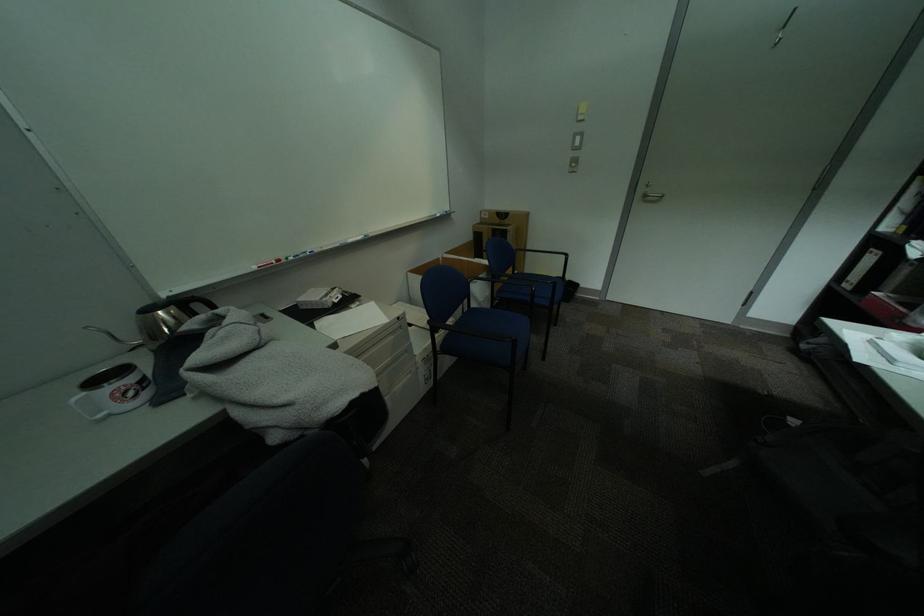
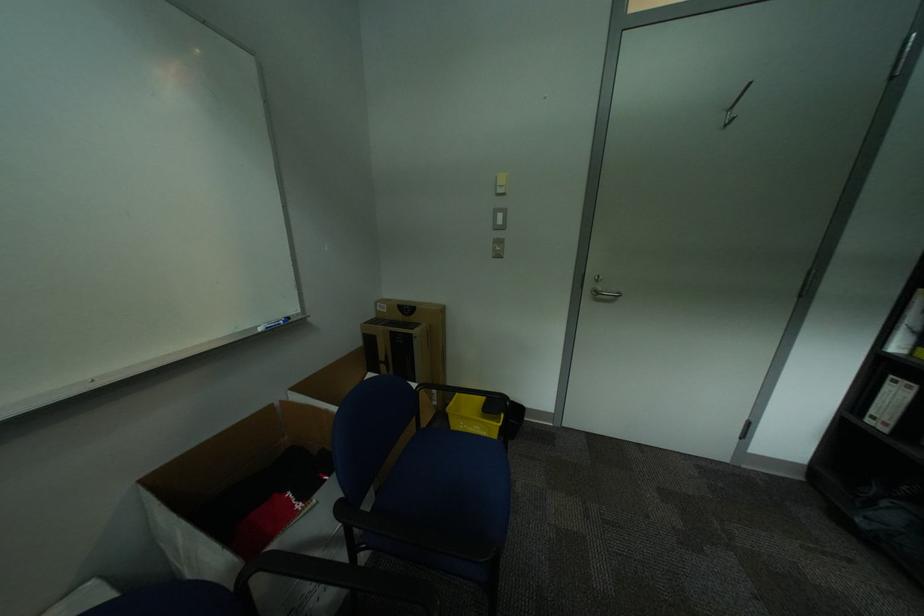
Which direction would the cameraman need to move to produce the second image?

The cameraman moved toward right, forward.